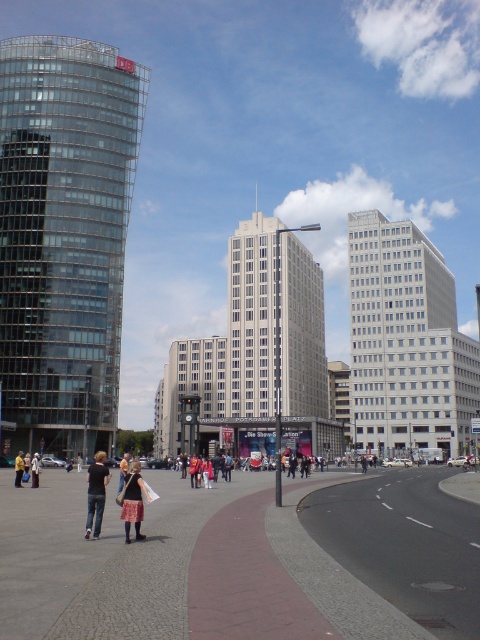
This screenshot has height=640, width=480. Identify the location of glassy modern skyscraper at left. (63, 236).

Between glassy modern skyscraper at left and white stone building at center, which one appears on the right side from the viewer's perspective?

From the viewer's perspective, white stone building at center appears more on the right side.

Is point (20, 330) positioned before point (296, 240)?

Yes, point (20, 330) is in front of point (296, 240).

The image size is (480, 640). I want to click on glassy modern skyscraper at left, so click(63, 236).

Describe the element at coordinates (243, 561) in the screenshot. I see `concrete sidewalk at center` at that location.

Between concrete sidewalk at center and white stone building at center, which one is positioned higher?

white stone building at center is above.

Between point (297, 520) and point (274, 236), which one is positioned in front?

Positioned in front is point (297, 520).

The height and width of the screenshot is (640, 480). Find the location of `concrete sidewalk at center`. concrete sidewalk at center is located at coordinates (243, 561).

Where is `concrete sidewalk at center`? concrete sidewalk at center is located at coordinates (243, 561).

Consider the image. Which is more to the right, concrete sidewalk at center or black cotton shirt at lower left?

From the viewer's perspective, concrete sidewalk at center appears more on the right side.

The width and height of the screenshot is (480, 640). Describe the element at coordinates (243, 561) in the screenshot. I see `concrete sidewalk at center` at that location.

At what (x,y) coordinates should I click in order to perform the action: click on concrete sidewalk at center. Please return your answer as a coordinate pair (x, y). This screenshot has height=640, width=480. Looking at the image, I should click on (243, 561).